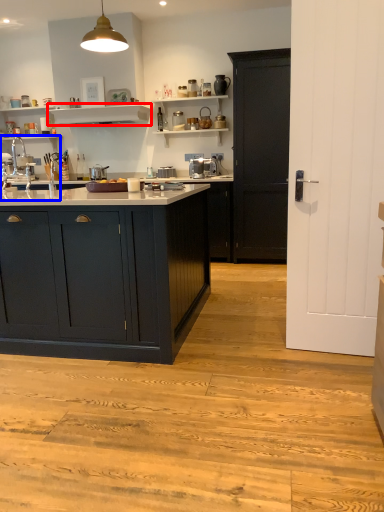
Question: Which object is closer to the camera taking this photo, shelf (highlighted by a red box) or sink (highlighted by a blue box)?

Choices:
 (A) shelf
 (B) sink

Answer: (B)